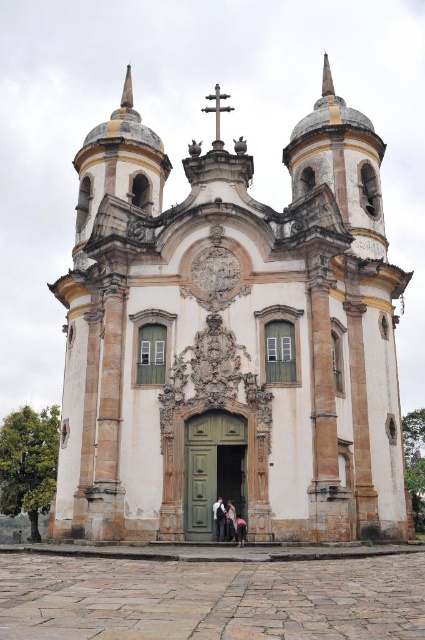
You are an architect designing a new building and want to ensure that the width of the light pink fabric at center matches the white stone church at center. According to the image, which object has a greater width and by how much?

The white stone church at center has a greater width than the light pink fabric at center, but the exact difference in measurement is not provided in the description.